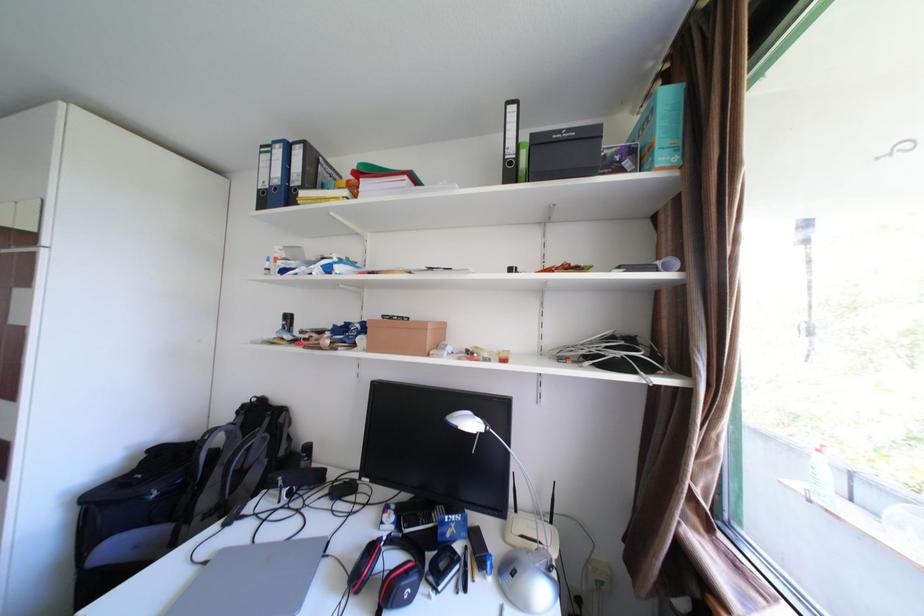
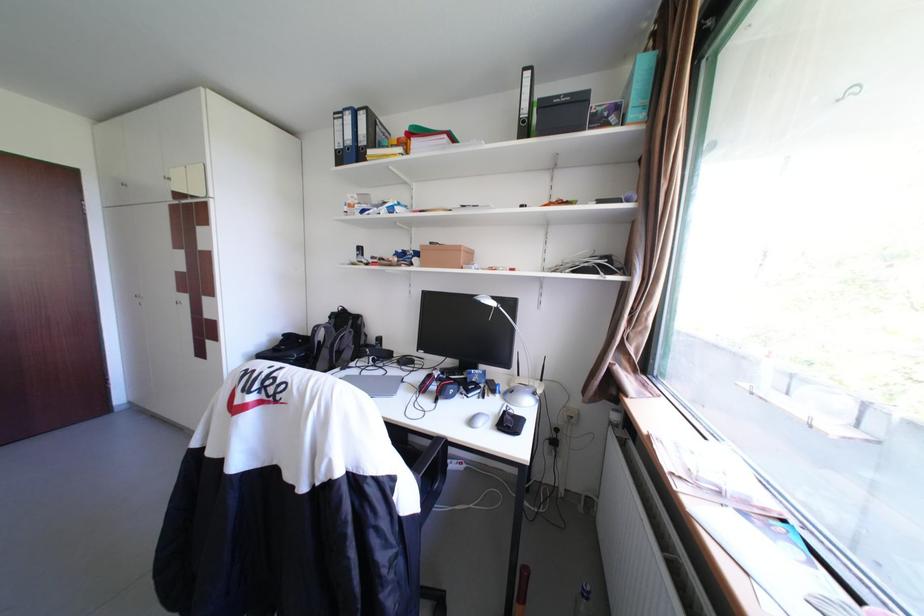
In the second image, find the point that corresponds to pixel 521 163 in the first image.

(535, 122)